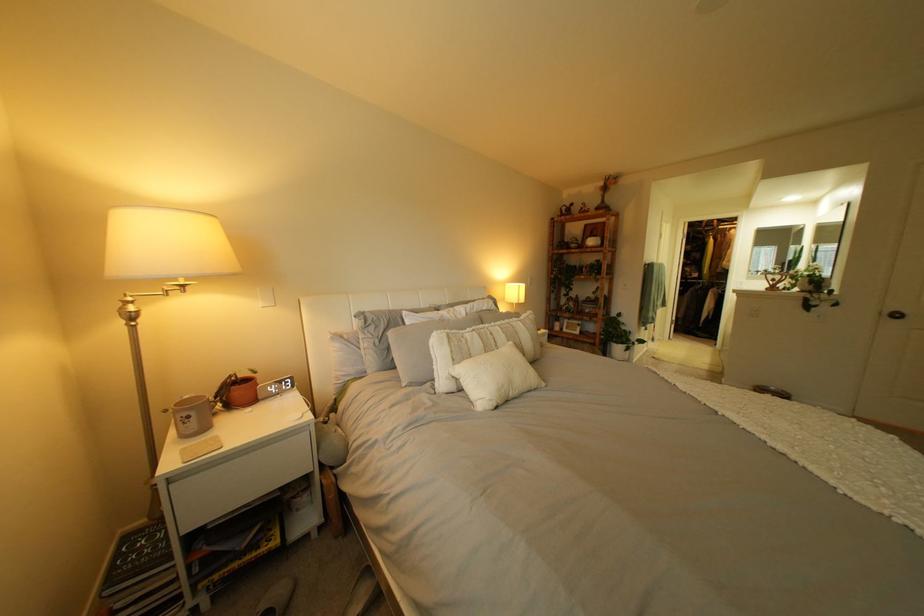
The height and width of the screenshot is (616, 924). What do you see at coordinates (128, 314) in the screenshot? I see `the lamp adjustment knob` at bounding box center [128, 314].